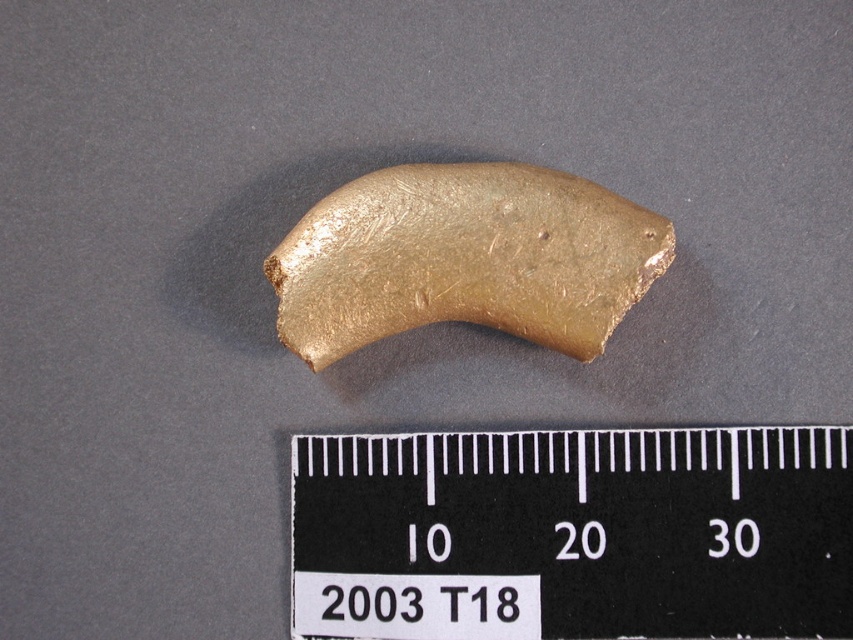
In order to click on black plastic ruler at center in this screenshot , I will do `click(572, 534)`.